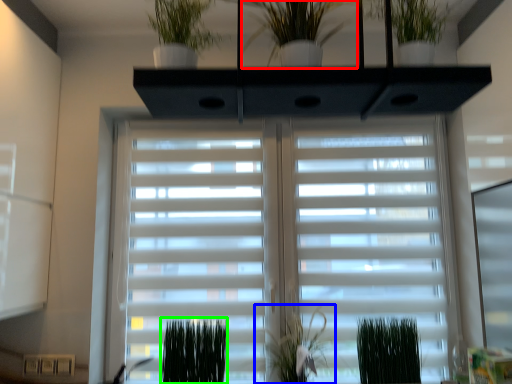
Question: Based on their relative distances, which object is farther from houseplant (highlighted by a red box)? Choose from plant (highlighted by a blue box) and plant (highlighted by a green box).

Choices:
 (A) plant
 (B) plant

Answer: (B)